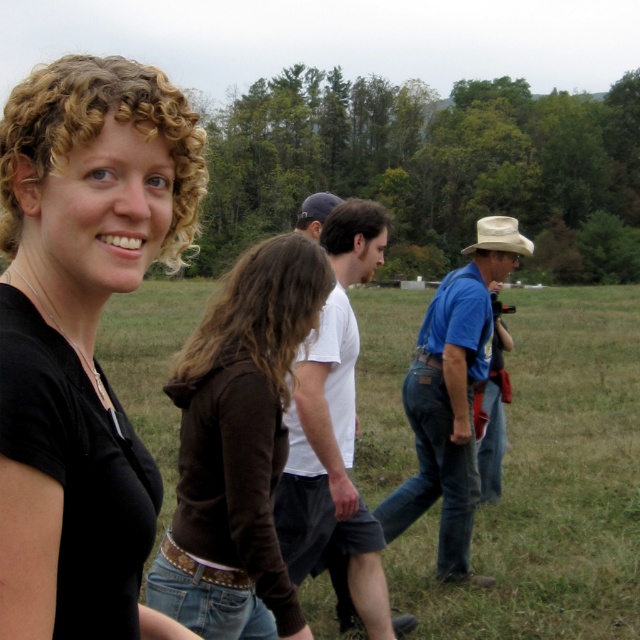
You are standing in the grassy field and want to take a photo of the two points mentioned. Which point is closer to you, point (356,544) or point (444,387)?

Point (356,544) is closer to the camera than point (444,387), so it is closer to you.